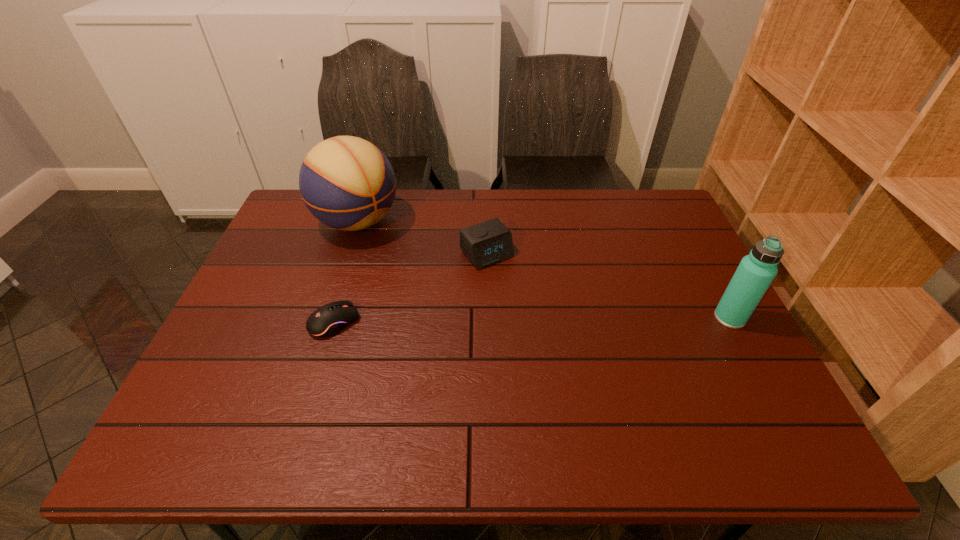
In the image, there is a desktop. Where is `vacant space at the right edge`? vacant space at the right edge is located at coordinates (660, 287).

The height and width of the screenshot is (540, 960). What are the coordinates of `free space at the far right corner of the desktop` in the screenshot? It's located at (660, 195).

You are a GUI agent. You are given a task and a screenshot of the screen. Output one action in this format:
    pyautogui.click(x=<x>, y=<y>)
    Task: Click on the empty space that is in between the basketball and the third tallest object
    Image resolution: width=960 pixels, height=540 pixels.
    Given the screenshot: What is the action you would take?
    click(x=422, y=238)

Image resolution: width=960 pixels, height=540 pixels. I want to click on vacant area that lies between the third object from left to right and the computer mouse, so click(x=411, y=288).

This screenshot has height=540, width=960. Find the location of `empty space between the basketball and the computer mouse`. empty space between the basketball and the computer mouse is located at coordinates (347, 272).

Find the location of `free space between the computer mouse and the third object from left to right`. free space between the computer mouse and the third object from left to right is located at coordinates (411, 288).

Identify the location of free space between the rightmost object and the computer mouse. (532, 320).

Identify the location of vacant space that is in between the basketball and the rightmost object. Image resolution: width=960 pixels, height=540 pixels. (543, 270).

Image resolution: width=960 pixels, height=540 pixels. Find the location of `vacant space that is in between the shortest object and the rightmost object`. vacant space that is in between the shortest object and the rightmost object is located at coordinates (532, 320).

Locate an element on the screen. The image size is (960, 540). free point between the thermos bottle and the second object from right to left is located at coordinates coord(609,286).